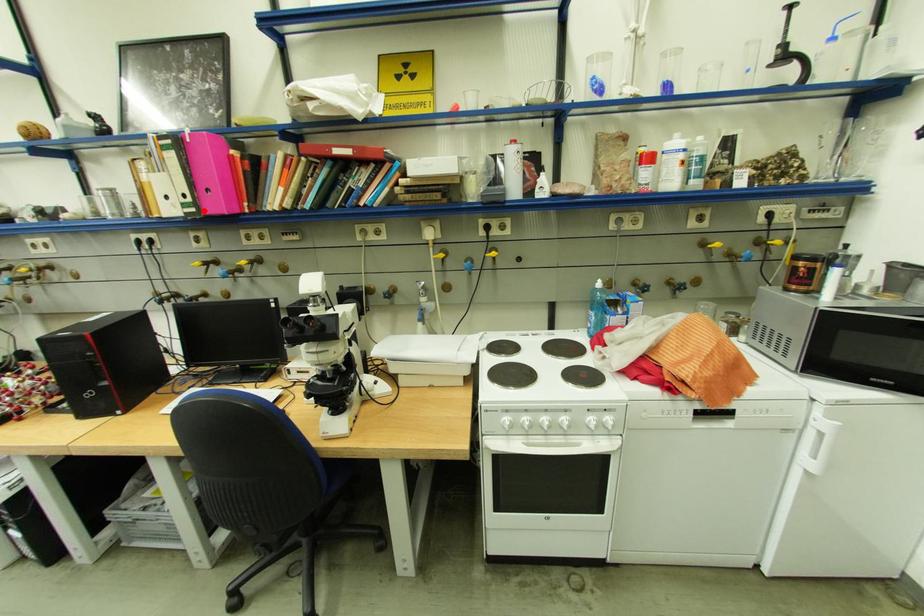
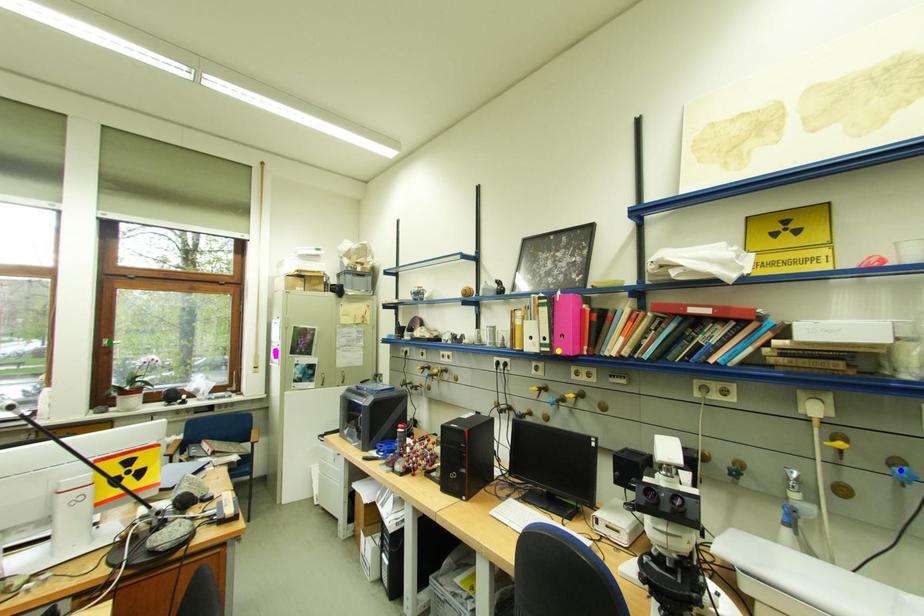
Question: I am providing you with two images of the same scene from different viewpoints. A red point is marked on the first image. You are given multiple points on the second image. Can you choose the point in image 2 that corresponds to the point in image 1?

Choices:
 (A) green point
 (B) yellow point
 (C) blue point

Answer: (B)